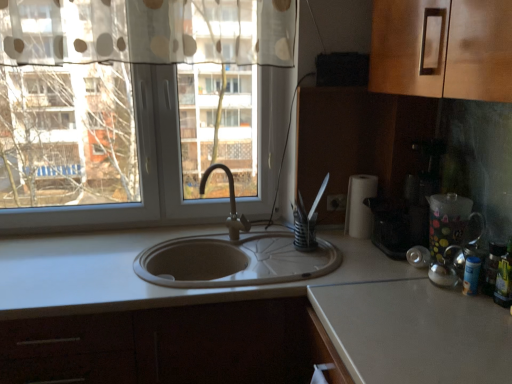
Question: Would you say transparent plastic pitcher at right is to the left or to the right of white matte countertop at center in the picture?

Choices:
 (A) left
 (B) right

Answer: (B)

Question: In terms of width, does transparent plastic pitcher at right look wider or thinner when compared to white matte countertop at center?

Choices:
 (A) thin
 (B) wide

Answer: (A)

Question: Which is farther from the matte silver faucet at center?

Choices:
 (A) black plastic coffee machine at right
 (B) green glass bottle at right
 (C) transparent plastic pitcher at right
 (D) white paper towel at right
 (E) white matte countertop at center

Answer: (B)

Question: Considering the real-world distances, which object is farthest from the transparent plastic pitcher at right?

Choices:
 (A) matte silver faucet at center
 (B) black plastic coffee machine at right
 (C) white paper towel at right
 (D) green glass bottle at right
 (E) white matte countertop at center

Answer: (A)